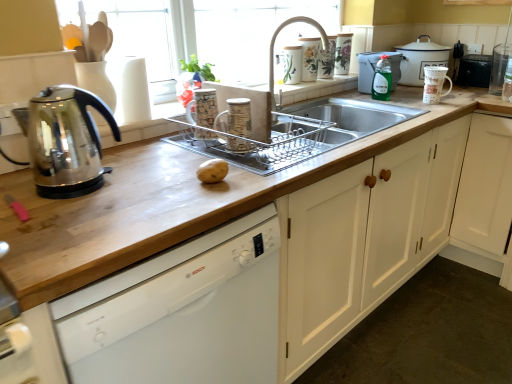
The height and width of the screenshot is (384, 512). I want to click on free space to the left of matte ceramic mug at upper center, the second appliance in the left-to-right sequence, so click(183, 149).